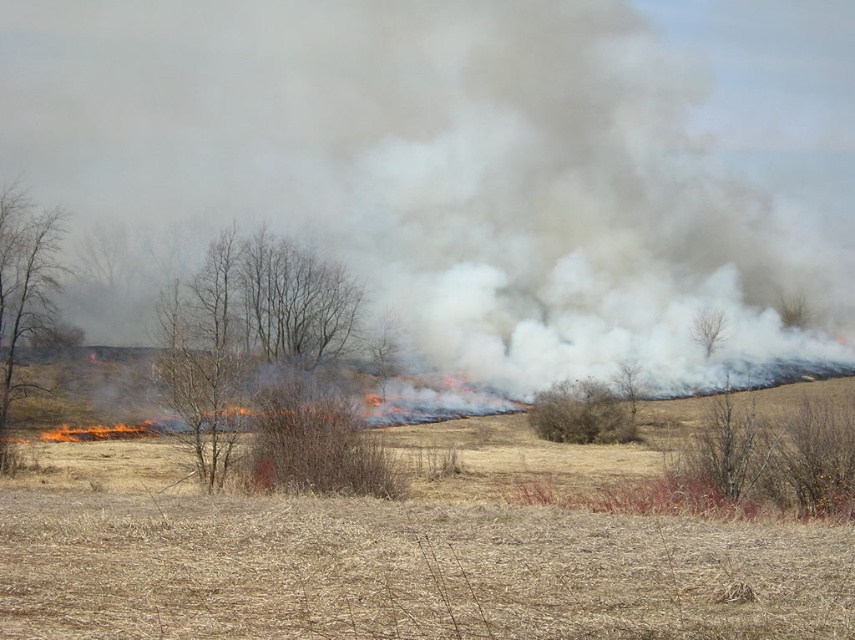
Question: Based on their relative distances, which object is nearer to the bare branches at left?

Choices:
 (A) brown dry bush at center
 (B) brown leafless tree at center

Answer: (B)

Question: Where is brown dry bush at center located in relation to brown textured tree at center in the image?

Choices:
 (A) right
 (B) left

Answer: (B)

Question: From the image, what is the correct spatial relationship of brown leafless tree at center in relation to bare branches at center?

Choices:
 (A) below
 (B) above

Answer: (B)

Question: Which point is farther to the camera?

Choices:
 (A) brown textured tree at center
 (B) brown leafless tree at center

Answer: (A)

Question: Among these points, which one is nearest to the camera?

Choices:
 (A) (314, 308)
 (B) (594, 410)
 (C) (628, 371)
 (D) (49, 312)

Answer: (D)

Question: Can you confirm if brown leafless tree at center is positioned to the right of bare branches at center?

Choices:
 (A) no
 (B) yes

Answer: (A)